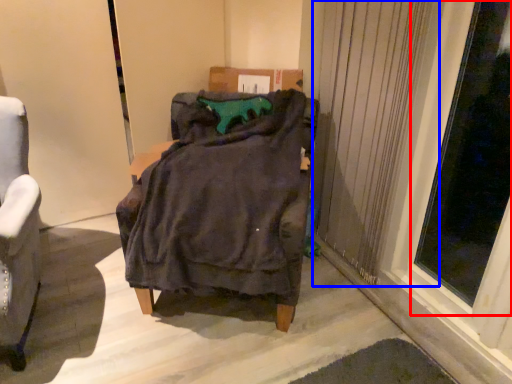
Question: Which point is further to the camera, window (highlighted by a red box) or curtain (highlighted by a blue box)?

Choices:
 (A) window
 (B) curtain

Answer: (B)